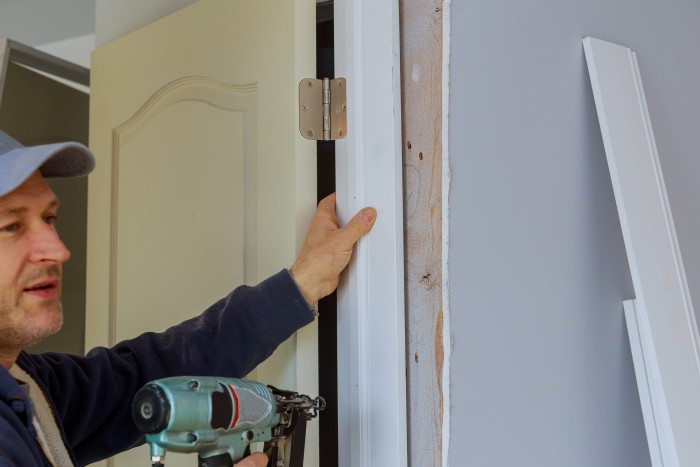
Where is `hinge`? The image size is (700, 467). hinge is located at coordinates (323, 111).